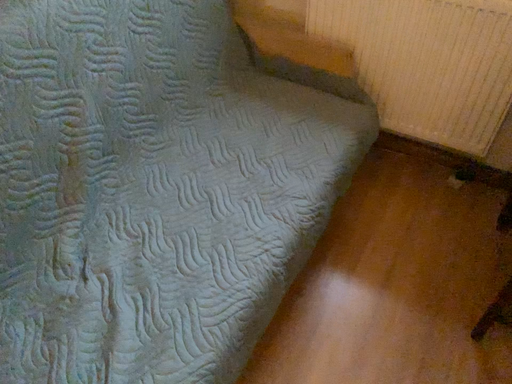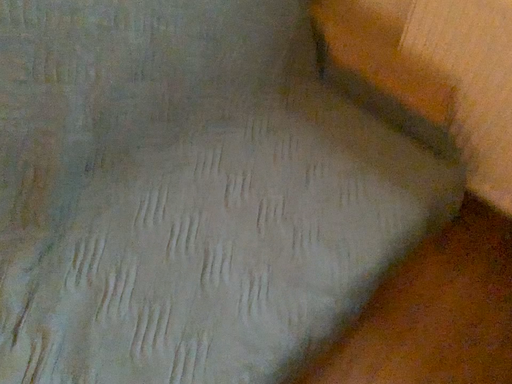
Question: Which way did the camera rotate in the video?

Choices:
 (A) rotated right
 (B) rotated left

Answer: (B)